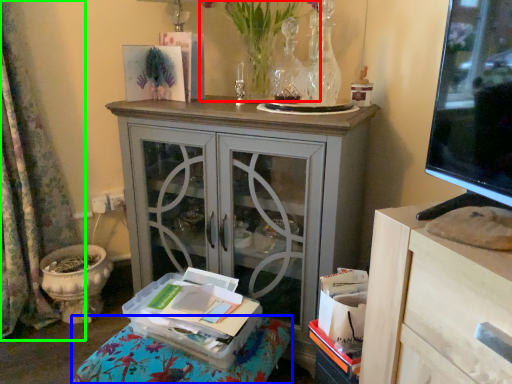
Question: Estimate the real-world distances between objects in this image. Which object is farther from floral arrangement (highlighted by a red box), furniture (highlighted by a blue box) or curtain (highlighted by a green box)?

Choices:
 (A) furniture
 (B) curtain

Answer: (A)